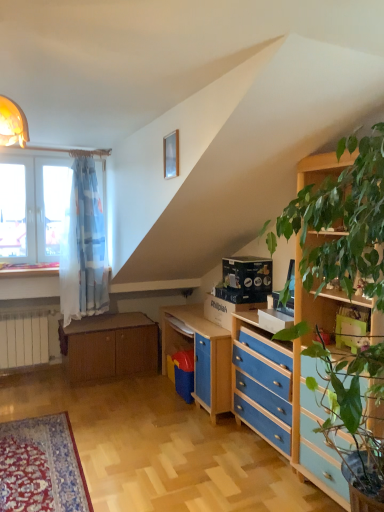
Question: Is wooden cabinet at lower left facing towards blue painted wood chest of drawers at lower right?

Choices:
 (A) no
 (B) yes

Answer: (B)

Question: Is the depth of wooden cabinet at lower left less than that of blue painted wood chest of drawers at lower right?

Choices:
 (A) no
 (B) yes

Answer: (A)

Question: From the image's perspective, would you say wooden cabinet at lower left is shown under blue painted wood chest of drawers at lower right?

Choices:
 (A) no
 (B) yes

Answer: (B)

Question: Is wooden cabinet at lower left completely or partially outside of blue painted wood chest of drawers at lower right?

Choices:
 (A) no
 (B) yes

Answer: (B)

Question: Considering the relative positions of wooden cabinet at lower left and blue painted wood chest of drawers at lower right in the image provided, is wooden cabinet at lower left to the right of blue painted wood chest of drawers at lower right from the viewer's perspective?

Choices:
 (A) no
 (B) yes

Answer: (A)

Question: From their relative heights in the image, would you say wooden cabinet at lower left is taller or shorter than wooden at left?

Choices:
 (A) tall
 (B) short

Answer: (A)

Question: Based on their positions, is wooden cabinet at lower left located to the left or right of wooden at left?

Choices:
 (A) left
 (B) right

Answer: (B)

Question: Looking at their shapes, would you say wooden cabinet at lower left is wider or thinner than wooden at left?

Choices:
 (A) wide
 (B) thin

Answer: (A)

Question: From a real-world perspective, is wooden cabinet at lower left positioned above or below wooden at left?

Choices:
 (A) below
 (B) above

Answer: (A)

Question: From a real-world perspective, is wooden at left physically located above or below wooden cabinet at lower left?

Choices:
 (A) above
 (B) below

Answer: (A)

Question: Is wooden at left bigger or smaller than wooden cabinet at lower left?

Choices:
 (A) big
 (B) small

Answer: (B)

Question: In terms of width, does wooden at left look wider or thinner when compared to wooden cabinet at lower left?

Choices:
 (A) wide
 (B) thin

Answer: (B)

Question: From the image's perspective, is wooden at left located above or below wooden cabinet at lower left?

Choices:
 (A) below
 (B) above

Answer: (B)

Question: From a real-world perspective, is blue painted wood chest of drawers at lower right above or below wooden cabinet at lower left?

Choices:
 (A) above
 (B) below

Answer: (A)

Question: Is blue painted wood chest of drawers at lower right situated inside wooden cabinet at lower left or outside?

Choices:
 (A) outside
 (B) inside

Answer: (A)